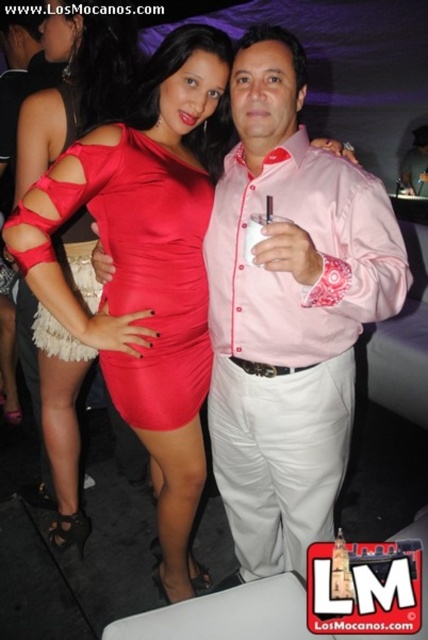
You are taking a photo of two people at a party. You notice two points in the image labeled as point 1 and point 2. If point 1 is at coordinate (x=305, y=248) and point 2 is at (x=273, y=216), which point is closer to the camera?

Point 1 at coordinate (x=305, y=248) is closer to the camera than point 2 at (x=273, y=216).

You are a photographer at a fashion show. You notice two dresses displayed on mannequins in the center of the stage. The satin dress at center and the matte red dress at center. Which dress is positioned lower on the mannequin?

The satin dress at center is positioned lower on the mannequin because it is described as being below the matte red dress at center.